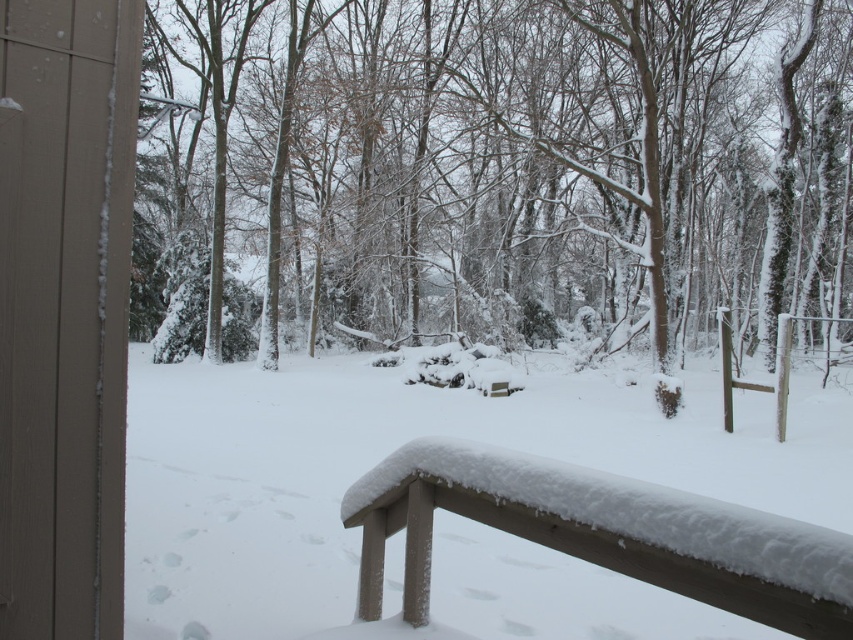
Question: Can you confirm if white fluffy snow at center is positioned to the right of snow-covered wood bench at lower center?

Choices:
 (A) no
 (B) yes

Answer: (B)

Question: Among these objects, which one is farthest from the camera?

Choices:
 (A) white fluffy snow at center
 (B) snow-covered tree at center

Answer: (B)

Question: Which object is the farthest from the white fluffy snow at center?

Choices:
 (A) snow-covered wood bench at lower center
 (B) snow-covered tree at center

Answer: (B)

Question: Observing the image, what is the correct spatial positioning of snow-covered tree at center in reference to snow-covered wood bench at lower center?

Choices:
 (A) below
 (B) above

Answer: (B)

Question: Is the position of white fluffy snow at center less distant than that of snow-covered wood bench at lower center?

Choices:
 (A) yes
 (B) no

Answer: (B)

Question: Among these points, which one is farthest from the camera?

Choices:
 (A) (395, 444)
 (B) (798, 614)
 (C) (271, 252)

Answer: (C)